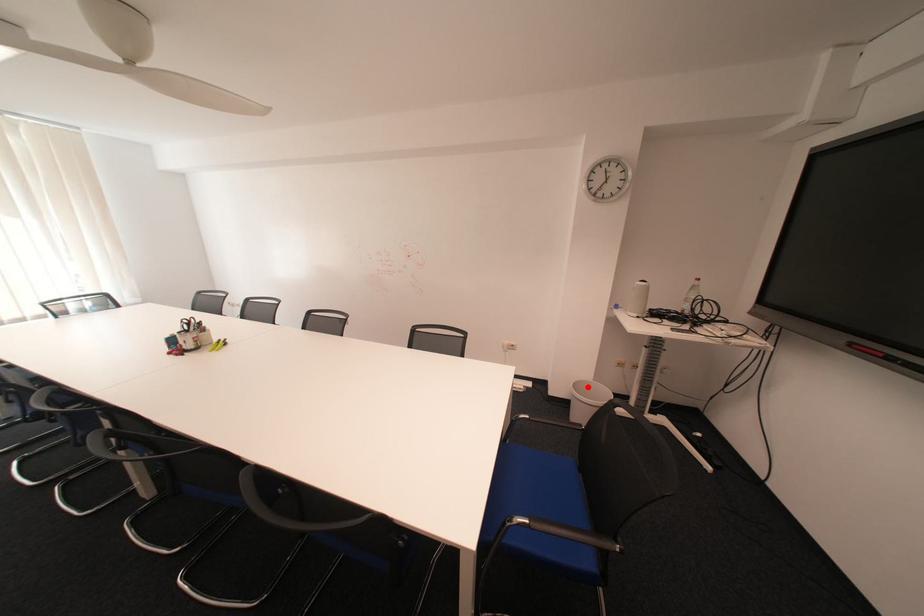
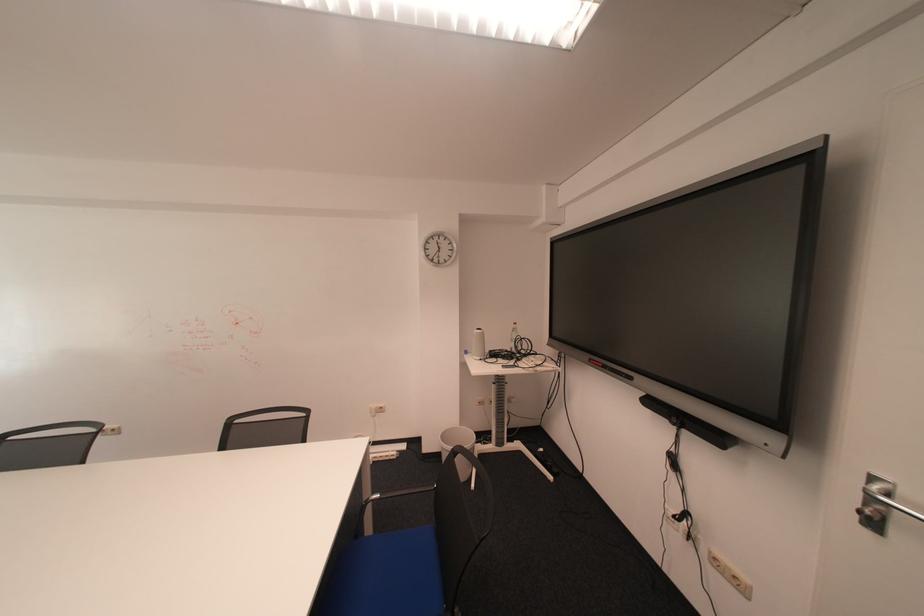
Find the pixel in the second image that matches the highlighted location in the first image.

(456, 437)